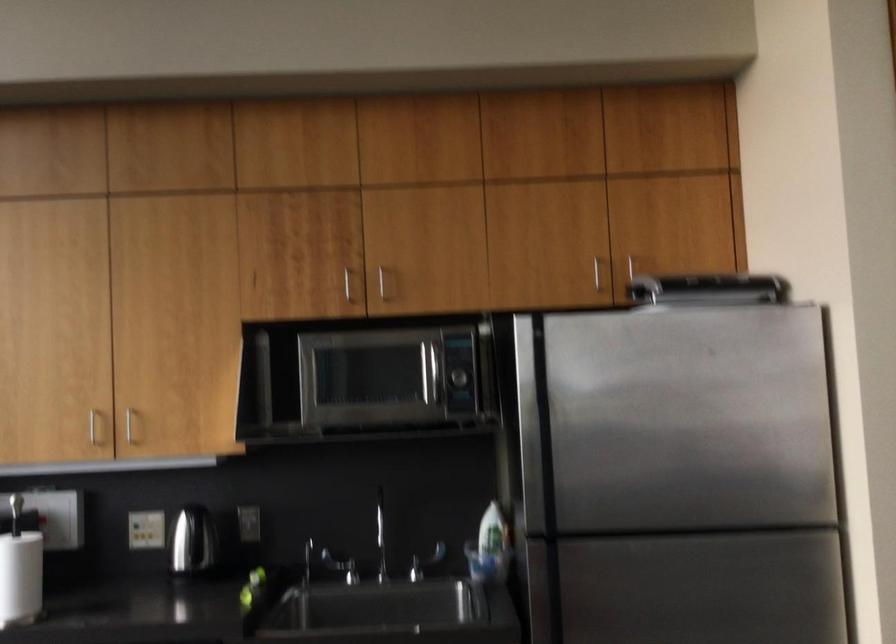
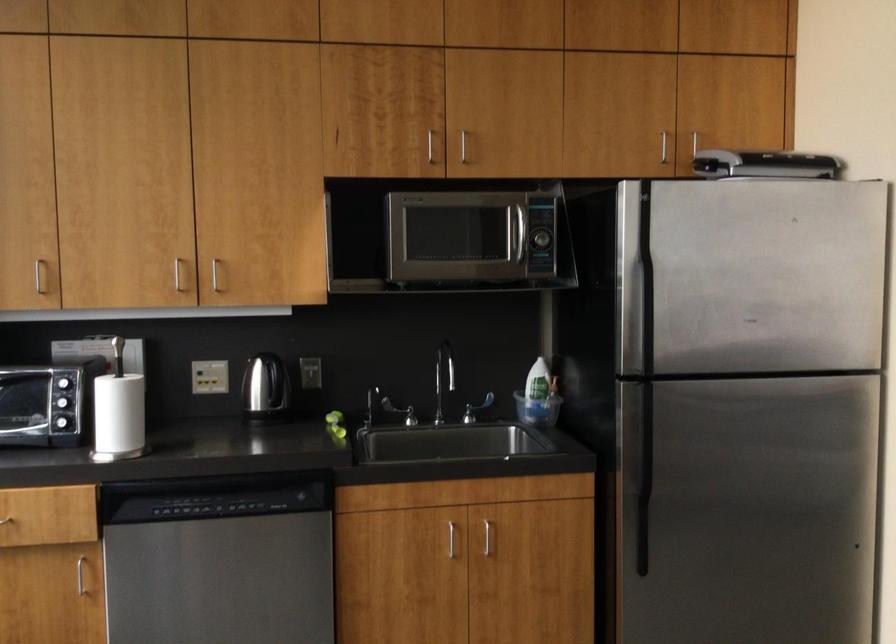
Locate, in the second image, the point that corresponds to point 383,281 in the first image.

(462, 146)